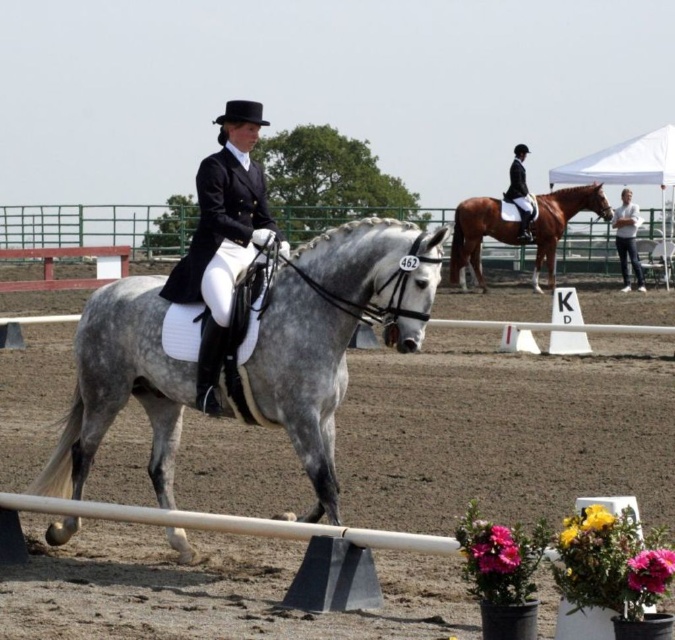
Does black satin riding jacket at center have a lesser height compared to white jeans at right?

Yes.

How much distance is there between black satin riding jacket at center and white jeans at right?

The distance of black satin riding jacket at center from white jeans at right is 19.60 meters.

The image size is (675, 640). Describe the element at coordinates (223, 237) in the screenshot. I see `black satin riding jacket at center` at that location.

Image resolution: width=675 pixels, height=640 pixels. Identify the location of black satin riding jacket at center. (223, 237).

Who is positioned more to the left, black satin riding jacket at center or shiny brown horse at upper right?

black satin riding jacket at center

Which is behind, point (196, 296) or point (549, 253)?

Point (549, 253)

You are a GUI agent. You are given a task and a screenshot of the screen. Output one action in this format:
    pyautogui.click(x=<x>, y=<y>)
    Task: Click on the black satin riding jacket at center
    
    Given the screenshot: What is the action you would take?
    pyautogui.click(x=223, y=237)

The height and width of the screenshot is (640, 675). In order to click on black satin riding jacket at center in this screenshot , I will do `click(223, 237)`.

Between black satin riding jacket at center and black leather jacket at center, which one appears on the right side from the viewer's perspective?

black leather jacket at center

What do you see at coordinates (223, 237) in the screenshot? I see `black satin riding jacket at center` at bounding box center [223, 237].

Find the location of `black satin riding jacket at center`. black satin riding jacket at center is located at coordinates (223, 237).